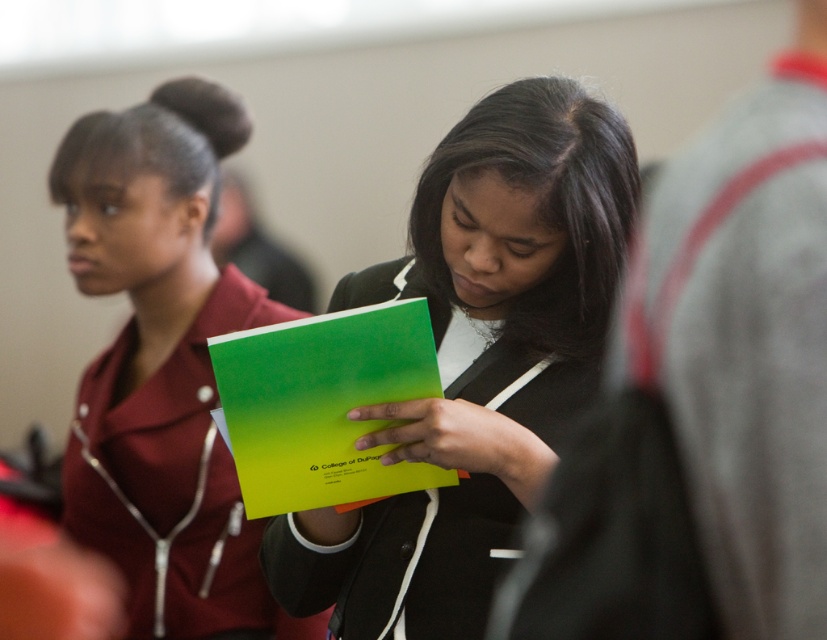
You are attending a meeting and need to hand over the matte green folder at center to someone. The maroon fabric shirt at upper left is the person you need to give it to. Can you directly hand them the folder without moving closer?

The matte green folder at center is closer to the viewer than maroon fabric shirt at upper left, so you would need to move closer to reach them.

You are organizing a meeting and need to place both the matte green folder at center and the green matte folder at center on a shelf. If the shelf has only enough space for one of them, which one should you choose based on their size?

The matte green folder at center has a larger size compared to the green matte folder at center, so you should choose the matte green folder at center to place on the shelf since it is larger and will occupy the available space.

You are an attendee at a conference and notice two folders at the center of the table. One is labeled as the matte green folder at center and the other is the green matte folder at center. Which folder is closer to you?

The matte green folder at center is closer to you because the green matte folder at center is behind it.